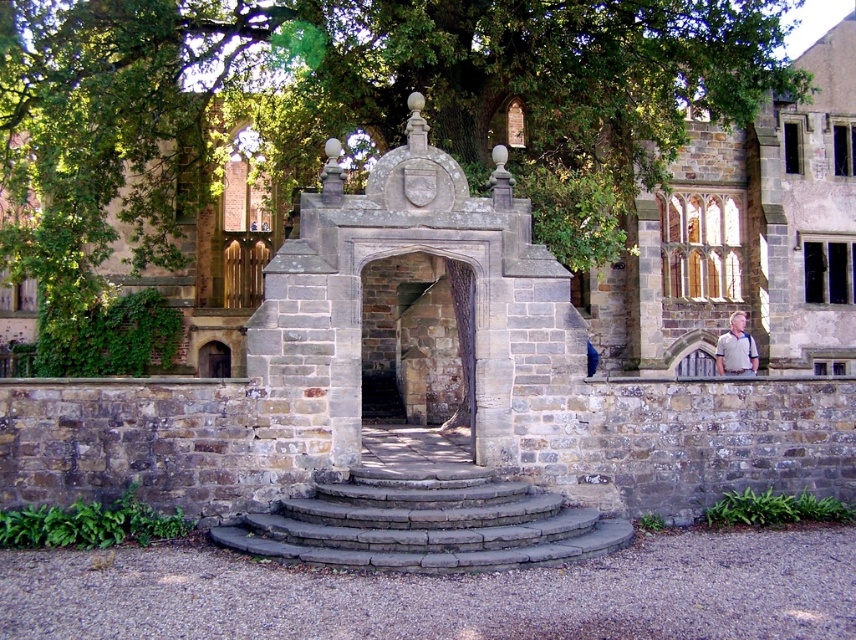
Consider the image. Can you confirm if green leafy tree at upper center is wider than stone archway at center?

Correct, the width of green leafy tree at upper center exceeds that of stone archway at center.

Which is more to the left, green leafy tree at upper center or stone archway at center?

Positioned to the left is green leafy tree at upper center.

The height and width of the screenshot is (640, 856). What are the coordinates of `green leafy tree at upper center` in the screenshot? It's located at (351, 106).

Is green leafy tree at upper center positioned before gray stone stairs at center?

No, green leafy tree at upper center is further to the viewer.

Which is behind, point (31, 128) or point (393, 499)?

Positioned behind is point (31, 128).

Which is in front, point (575, 148) or point (269, 547)?

Positioned in front is point (269, 547).

The height and width of the screenshot is (640, 856). Find the location of `green leafy tree at upper center`. green leafy tree at upper center is located at coordinates (351, 106).

Which of these two, stone archway at center or gray cotton shirt at right, stands shorter?

gray cotton shirt at right is shorter.

Between point (456, 356) and point (742, 328), which one is positioned in front?

Positioned in front is point (742, 328).

Does point (409, 387) come in front of point (740, 365)?

No.

Find the location of a particular element. The image size is (856, 640). stone archway at center is located at coordinates (418, 342).